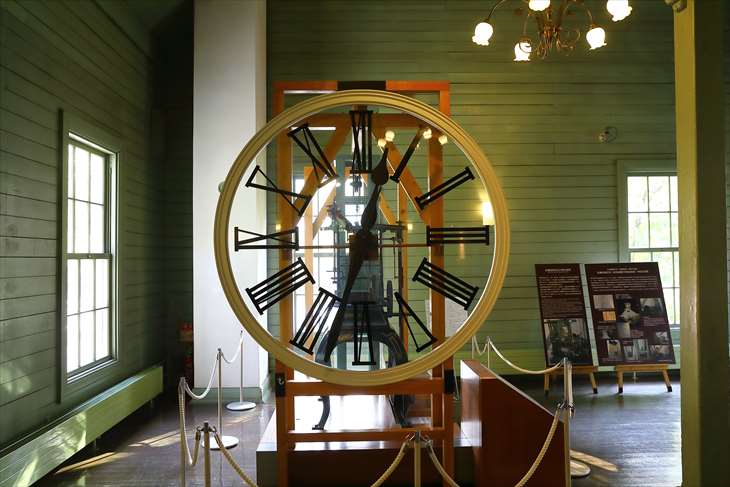
Find the location of a particular element. The image size is (730, 487). walls is located at coordinates (526, 122), (74, 72).